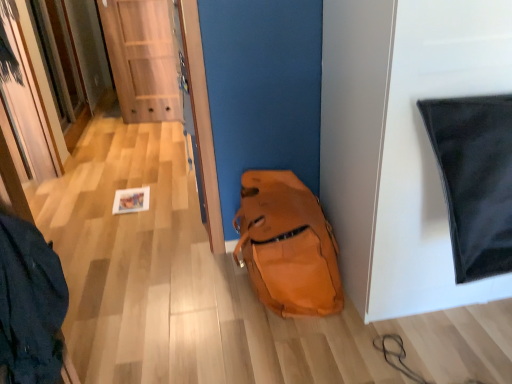
In order to face wooden door at center, should I rotate leftwards or rightwards?

To face it directly, rotate left by 14.695 degrees.

This screenshot has height=384, width=512. What do you see at coordinates (142, 58) in the screenshot?
I see `wooden door at center` at bounding box center [142, 58].

At what (x,y) coordinates should I click in order to perform the action: click on wooden door at center. Please return your answer as a coordinate pair (x, y). Looking at the image, I should click on (142, 58).

What is the approximate height of orange leather backpack at lower center?

orange leather backpack at lower center is 17.22 inches tall.

Where is `orange leather backpack at lower center`? The image size is (512, 384). orange leather backpack at lower center is located at coordinates (287, 245).

Describe the element at coordinates (287, 245) in the screenshot. The height and width of the screenshot is (384, 512). I see `orange leather backpack at lower center` at that location.

Where is `wooden door at center`? wooden door at center is located at coordinates (142, 58).

Can you confirm if orange leather backpack at lower center is positioned to the left of wooden door at center?

No.

Is the position of orange leather backpack at lower center less distant than that of wooden door at center?

Yes, it is in front of wooden door at center.

Is point (263, 213) positioned after point (117, 29)?

No, (263, 213) is in front of (117, 29).

From the image's perspective, between orange leather backpack at lower center and wooden door at center, which one is located above?

wooden door at center is shown above in the image.

From a real-world perspective, between orange leather backpack at lower center and wooden door at center, who is vertically higher?

In real-world perspective, wooden door at center is above.

Considering the relative sizes of orange leather backpack at lower center and wooden door at center in the image provided, is orange leather backpack at lower center wider than wooden door at center?

Correct, the width of orange leather backpack at lower center exceeds that of wooden door at center.

Is orange leather backpack at lower center taller or shorter than wooden door at center?

Clearly, orange leather backpack at lower center is shorter compared to wooden door at center.

Between orange leather backpack at lower center and wooden door at center, which one has smaller size?

wooden door at center is smaller.

Would you say orange leather backpack at lower center is outside wooden door at center?

orange leather backpack at lower center is positioned outside wooden door at center.

Can you see orange leather backpack at lower center touching wooden door at center?

No, orange leather backpack at lower center is not with wooden door at center.

Does orange leather backpack at lower center turn towards wooden door at center?

No.

Can you tell me how much orange leather backpack at lower center and wooden door at center differ in facing direction?

The angle between the facing direction of orange leather backpack at lower center and the facing direction of wooden door at center is 7.3 degrees.

The height and width of the screenshot is (384, 512). Identify the location of backpack that appears below the wooden door at center (from the image's perspective). (287, 245).

Between wooden door at center and orange leather backpack at lower center, which one appears on the left side from the viewer's perspective?

From the viewer's perspective, wooden door at center appears more on the left side.

Is wooden door at center positioned in front of orange leather backpack at lower center?

No, wooden door at center is further to the viewer.

Does point (130, 97) come closer to viewer compared to point (337, 289)?

That is False.

From the image's perspective, which object appears higher, wooden door at center or orange leather backpack at lower center?

From the image's view, wooden door at center is above.

From a real-world perspective, which is physically above, wooden door at center or orange leather backpack at lower center?

From a 3D spatial view, wooden door at center is above.

Between wooden door at center and orange leather backpack at lower center, which one has smaller width?

With smaller width is wooden door at center.

Does wooden door at center have a greater height compared to orange leather backpack at lower center?

Yes.

In terms of size, does wooden door at center appear bigger or smaller than orange leather backpack at lower center?

wooden door at center is smaller than orange leather backpack at lower center.

Is wooden door at center situated inside orange leather backpack at lower center or outside?

The correct answer is: outside.

Are wooden door at center and orange leather backpack at lower center located far from each other?

wooden door at center is positioned a significant distance from orange leather backpack at lower center.

Is orange leather backpack at lower center at the back of wooden door at center?

That's not correct — wooden door at center is not looking away from orange leather backpack at lower center.

Can you tell me how much wooden door at center and orange leather backpack at lower center differ in facing direction?

7.3 degrees.

The height and width of the screenshot is (384, 512). I want to click on door lying above the orange leather backpack at lower center (from the image's perspective), so [142, 58].

Locate an element on the screen. backpack below the wooden door at center (from the image's perspective) is located at coordinates (287, 245).

The width and height of the screenshot is (512, 384). Find the location of `backpack in front of the wooden door at center`. backpack in front of the wooden door at center is located at coordinates (287, 245).